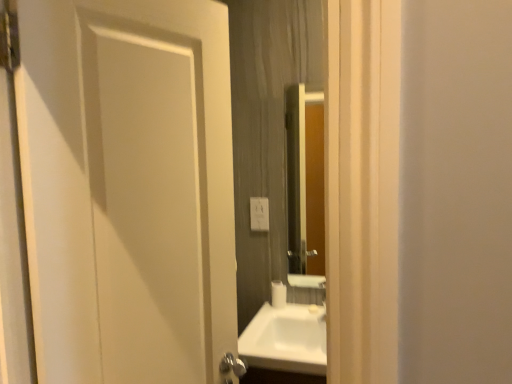
What is the approximate width of white matte toilet paper at center?

The width of white matte toilet paper at center is 3.35 inches.

The image size is (512, 384). Describe the element at coordinates (259, 214) in the screenshot. I see `white plastic electric outlet at center` at that location.

Where is `white matte toilet paper at center`? Image resolution: width=512 pixels, height=384 pixels. white matte toilet paper at center is located at coordinates (278, 294).

How different are the orientations of white glossy sink at center and white plastic electric outlet at center in degrees?

white glossy sink at center and white plastic electric outlet at center are facing 0.468 degrees away from each other.

Is white glossy sink at center further to camera compared to white plastic electric outlet at center?

No, white glossy sink at center is closer to the camera.

From the picture: Is white glossy sink at center in contact with white plastic electric outlet at center?

white glossy sink at center and white plastic electric outlet at center are clearly separated.

Which object is further away from the camera taking this photo, smooth wooden mirror at center or white plastic electric outlet at center?

white plastic electric outlet at center is further from the camera.

Is smooth wooden mirror at center facing towards white plastic electric outlet at center?

No, smooth wooden mirror at center is not facing towards white plastic electric outlet at center.

Is smooth wooden mirror at center not near white plastic electric outlet at center?

No, smooth wooden mirror at center is in close proximity to white plastic electric outlet at center.

From a real-world perspective, which is physically below, smooth wooden mirror at center or white plastic electric outlet at center?

white plastic electric outlet at center, from a real-world perspective.

Is white glossy sink at center further to camera compared to white matte toilet paper at center?

No, it is not.

How many degrees apart are the facing directions of white glossy sink at center and white matte toilet paper at center?

5.22 degrees.

Considering the points (257, 346) and (284, 285), which point is in front, point (257, 346) or point (284, 285)?

Positioned in front is point (257, 346).

Consider the image. In the image, is smooth wooden mirror at center on the left side or the right side of white matte door at left?

smooth wooden mirror at center is positioned on white matte door at left's right side.

Looking at their sizes, would you say smooth wooden mirror at center is wider or thinner than white matte door at left?

smooth wooden mirror at center is thinner than white matte door at left.

From the image's perspective, is smooth wooden mirror at center over white matte door at left?

Correct, smooth wooden mirror at center appears higher than white matte door at left in the image.

Does smooth wooden mirror at center have a smaller size compared to white matte door at left?

Indeed, smooth wooden mirror at center has a smaller size compared to white matte door at left.

Is white matte door at left beside smooth wooden mirror at center?

No, white matte door at left is not making contact with smooth wooden mirror at center.

From the image's perspective, would you say white matte door at left is shown under smooth wooden mirror at center?

Indeed, from the image's perspective, white matte door at left is shown beneath smooth wooden mirror at center.

How far apart are white matte door at left and smooth wooden mirror at center?

white matte door at left and smooth wooden mirror at center are 1.09 meters apart from each other.

Who is smaller, white matte door at left or smooth wooden mirror at center?

smooth wooden mirror at center.

Is smooth wooden mirror at center in contact with white glossy sink at center?

smooth wooden mirror at center and white glossy sink at center are clearly separated.

Is smooth wooden mirror at center positioned beyond the bounds of white glossy sink at center?

Yes, smooth wooden mirror at center is located beyond the bounds of white glossy sink at center.

In the scene shown: Between smooth wooden mirror at center and white glossy sink at center, which one has more height?

smooth wooden mirror at center.

Between smooth wooden mirror at center and white glossy sink at center, which one has smaller width?

With smaller width is smooth wooden mirror at center.

Does white matte door at left have a greater height compared to white glossy sink at center?

Yes, white matte door at left is taller than white glossy sink at center.

Find the location of a particular element. The width and height of the screenshot is (512, 384). door above the white glossy sink at center (from a real-world perspective) is located at coordinates (128, 189).

Is white matte door at left at the left side of white glossy sink at center?

Indeed, white matte door at left is positioned on the left side of white glossy sink at center.

This screenshot has width=512, height=384. Find the location of `electric outlet above the white glossy sink at center (from the image's perspective)`. electric outlet above the white glossy sink at center (from the image's perspective) is located at coordinates (259, 214).

Where is `electric outlet behind the smooth wooden mirror at center`? electric outlet behind the smooth wooden mirror at center is located at coordinates (259, 214).

From the image, which object appears to be farther from smooth wooden mirror at center, white matte toilet paper at center or white glossy sink at center?

The object further to smooth wooden mirror at center is white matte toilet paper at center.

From the image, which object appears to be nearer to white matte door at left, smooth wooden mirror at center or white plastic electric outlet at center?

white plastic electric outlet at center is closer to white matte door at left.

When comparing their distances from white matte toilet paper at center, does white plastic electric outlet at center or smooth wooden mirror at center seem closer?

The object closer to white matte toilet paper at center is white plastic electric outlet at center.

When comparing their distances from white matte door at left, does white matte toilet paper at center or white glossy sink at center seem further?

white matte toilet paper at center is positioned further to the anchor white matte door at left.

When comparing their distances from white plastic electric outlet at center, does white glossy sink at center or white matte toilet paper at center seem closer?

white matte toilet paper at center is closer to white plastic electric outlet at center.

Which object lies nearer to the anchor point white glossy sink at center, white matte door at left or smooth wooden mirror at center?

The object closer to white glossy sink at center is white matte door at left.

From the image, which object appears to be nearer to white matte toilet paper at center, white glossy sink at center or white plastic electric outlet at center?

Based on the image, white glossy sink at center appears to be nearer to white matte toilet paper at center.

From the image, which object appears to be nearer to white matte toilet paper at center, white glossy sink at center or smooth wooden mirror at center?

white glossy sink at center is positioned closer to the anchor white matte toilet paper at center.

Find the location of a particular element. This screenshot has width=512, height=384. toilet paper between smooth wooden mirror at center and white glossy sink at center in the vertical direction is located at coordinates (278, 294).

Where is `electric outlet between smooth wooden mirror at center and white glossy sink at center from top to bottom`? This screenshot has height=384, width=512. electric outlet between smooth wooden mirror at center and white glossy sink at center from top to bottom is located at coordinates (259, 214).

Where is `mirror between white matte door at left and white matte toilet paper at center along the z-axis`? mirror between white matte door at left and white matte toilet paper at center along the z-axis is located at coordinates (305, 186).

Find the location of `sink between white matte door at left and white plastic electric outlet at center from front to back`. sink between white matte door at left and white plastic electric outlet at center from front to back is located at coordinates (286, 339).